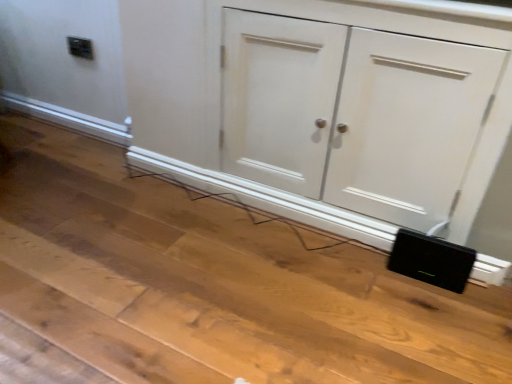
Describe the element at coordinates (324, 107) in the screenshot. I see `white matte cupboard at lower right` at that location.

Locate an element on the screen. The width and height of the screenshot is (512, 384). black matte speaker at lower right is located at coordinates (431, 260).

In order to click on white matte cupboard at lower right in this screenshot , I will do `click(324, 107)`.

In the scene shown: Considering the sizes of black plastic electric outlet at upper left and black matte speaker at lower right in the image, is black plastic electric outlet at upper left bigger or smaller than black matte speaker at lower right?

black plastic electric outlet at upper left is smaller than black matte speaker at lower right.

From the image's perspective, is black plastic electric outlet at upper left below black matte speaker at lower right?

No, from the image's perspective, black plastic electric outlet at upper left is not beneath black matte speaker at lower right.

In the scene shown: Considering the sizes of black plastic electric outlet at upper left and black matte speaker at lower right in the image, is black plastic electric outlet at upper left taller or shorter than black matte speaker at lower right?

black plastic electric outlet at upper left is shorter than black matte speaker at lower right.

Considering the points (87, 58) and (449, 282), which point is behind, point (87, 58) or point (449, 282)?

The point (87, 58) is more distant.

Would you consider black matte speaker at lower right to be distant from black plastic electric outlet at upper left?

Absolutely, black matte speaker at lower right is distant from black plastic electric outlet at upper left.

Which object is wider, black matte speaker at lower right or black plastic electric outlet at upper left?

With larger width is black matte speaker at lower right.

Does black matte speaker at lower right lie in front of black plastic electric outlet at upper left?

Yes, it is in front of black plastic electric outlet at upper left.

Does black plastic electric outlet at upper left have a greater width compared to white matte cupboard at lower right?

Incorrect, the width of black plastic electric outlet at upper left does not surpass that of white matte cupboard at lower right.

Is black plastic electric outlet at upper left oriented away from white matte cupboard at lower right?

black plastic electric outlet at upper left is not turned away from white matte cupboard at lower right.

Would you say black plastic electric outlet at upper left contains white matte cupboard at lower right?

No, white matte cupboard at lower right is not inside black plastic electric outlet at upper left.

Between point (75, 42) and point (402, 36), which one is positioned behind?

The point (75, 42) is farther from the camera.

Is white matte cupboard at lower right not near black matte speaker at lower right?

No, white matte cupboard at lower right is not far from black matte speaker at lower right.

From the image's perspective, between white matte cupboard at lower right and black matte speaker at lower right, which one is located above?

white matte cupboard at lower right is shown above in the image.

Where is `speaker on the right side of white matte cupboard at lower right`? This screenshot has width=512, height=384. speaker on the right side of white matte cupboard at lower right is located at coordinates (431, 260).

Is white matte cupboard at lower right not inside black matte speaker at lower right?

Yes, white matte cupboard at lower right is not within black matte speaker at lower right.

In the scene shown: Considering the sizes of white matte cupboard at lower right and black plastic electric outlet at upper left in the image, is white matte cupboard at lower right wider or thinner than black plastic electric outlet at upper left?

Considering their sizes, white matte cupboard at lower right looks broader than black plastic electric outlet at upper left.

Considering the positions of objects white matte cupboard at lower right and black plastic electric outlet at upper left in the image provided, who is more to the right, white matte cupboard at lower right or black plastic electric outlet at upper left?

Positioned to the right is white matte cupboard at lower right.

Between white matte cupboard at lower right and black plastic electric outlet at upper left, which one has less height?

black plastic electric outlet at upper left is shorter.

You are a GUI agent. You are given a task and a screenshot of the screen. Output one action in this format:
    pyautogui.click(x=<x>, y=<y>)
    Task: Click on the cupboard lying on the right of black plastic electric outlet at upper left
    This screenshot has width=512, height=384.
    Given the screenshot: What is the action you would take?
    pyautogui.click(x=324, y=107)

Looking at this image, considering the sizes of objects black matte speaker at lower right and white matte cupboard at lower right in the image provided, who is smaller, black matte speaker at lower right or white matte cupboard at lower right?

black matte speaker at lower right is smaller.

Consider the image. Measure the distance between black matte speaker at lower right and white matte cupboard at lower right.

The distance of black matte speaker at lower right from white matte cupboard at lower right is 17.73 inches.

Identify the location of speaker that appears behind the white matte cupboard at lower right. (431, 260).

Is black matte speaker at lower right shorter than white matte cupboard at lower right?

Yes.

There is a black matte speaker at lower right. Where is `electric outlet above it (from a real-world perspective)`? The height and width of the screenshot is (384, 512). electric outlet above it (from a real-world perspective) is located at coordinates (80, 47).

You are a GUI agent. You are given a task and a screenshot of the screen. Output one action in this format:
    pyautogui.click(x=<x>, y=<y>)
    Task: Click on the electric outlet on the left of black matte speaker at lower right
    The image size is (512, 384).
    Given the screenshot: What is the action you would take?
    pyautogui.click(x=80, y=47)

Considering their positions, is white matte cupboard at lower right positioned closer to black plastic electric outlet at upper left than black matte speaker at lower right?

white matte cupboard at lower right is closer to black plastic electric outlet at upper left.

From the image, which object appears to be nearer to black matte speaker at lower right, black plastic electric outlet at upper left or white matte cupboard at lower right?

Among the two, white matte cupboard at lower right is located nearer to black matte speaker at lower right.

From the image, which object appears to be farther from black plastic electric outlet at upper left, black matte speaker at lower right or white matte cupboard at lower right?

Among the two, black matte speaker at lower right is located further to black plastic electric outlet at upper left.

Based on their spatial positions, is black matte speaker at lower right or black plastic electric outlet at upper left further from white matte cupboard at lower right?

black plastic electric outlet at upper left.

Looking at the image, which one is located further to white matte cupboard at lower right, black plastic electric outlet at upper left or black matte speaker at lower right?

The object further to white matte cupboard at lower right is black plastic electric outlet at upper left.

Based on their spatial positions, is white matte cupboard at lower right or black plastic electric outlet at upper left closer to black matte speaker at lower right?

Among the two, white matte cupboard at lower right is located nearer to black matte speaker at lower right.

Image resolution: width=512 pixels, height=384 pixels. I want to click on cupboard between black plastic electric outlet at upper left and black matte speaker at lower right, so click(x=324, y=107).